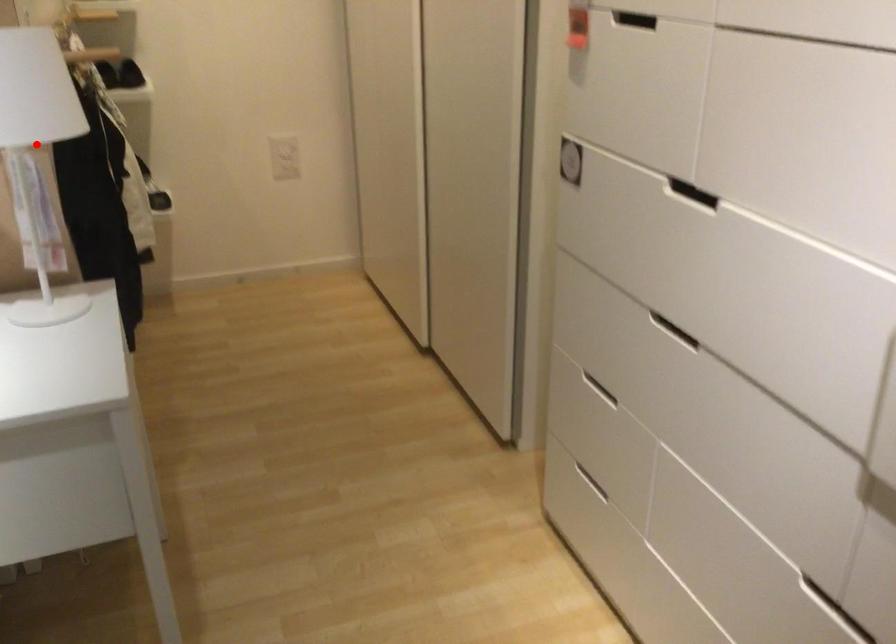
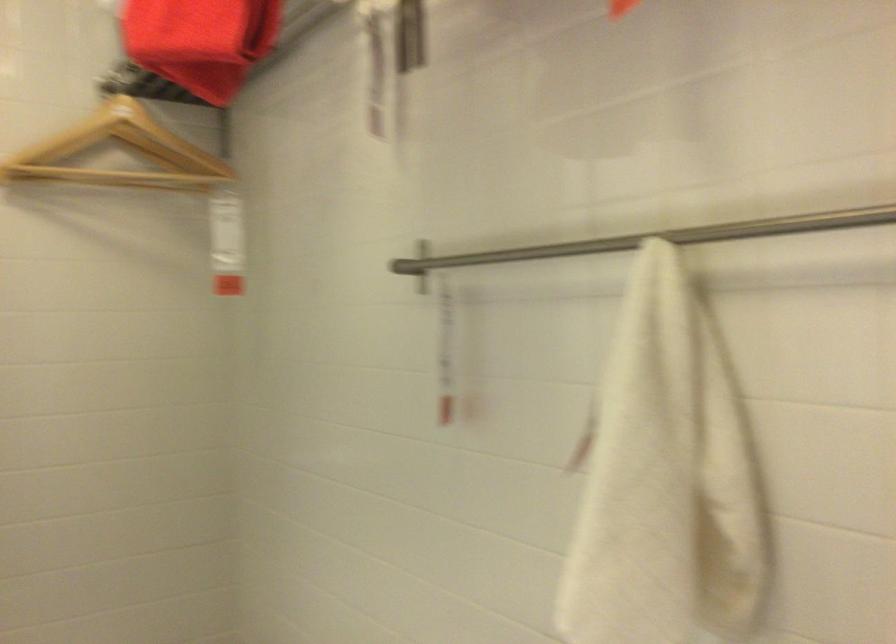
Question: I am providing you with two images of the same scene from different viewpoints. A red point is marked on the first image. Can you still see the location of the red point in image 2?

Choices:
 (A) Yes
 (B) No

Answer: (B)